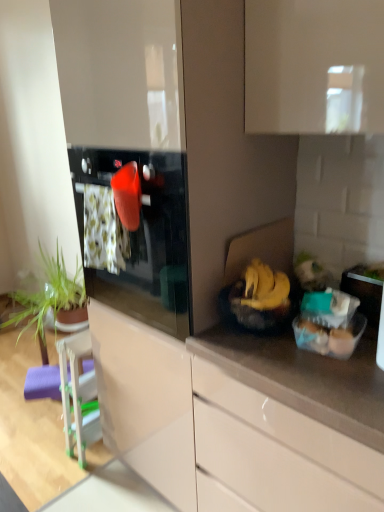
You are a GUI agent. You are given a task and a screenshot of the screen. Output one action in this format:
    pyautogui.click(x=<x>, y=<y>)
    Task: Click on the vacant region to the left of translucent plastic eggs at right
    The image size is (384, 512).
    Given the screenshot: What is the action you would take?
    pyautogui.click(x=272, y=358)